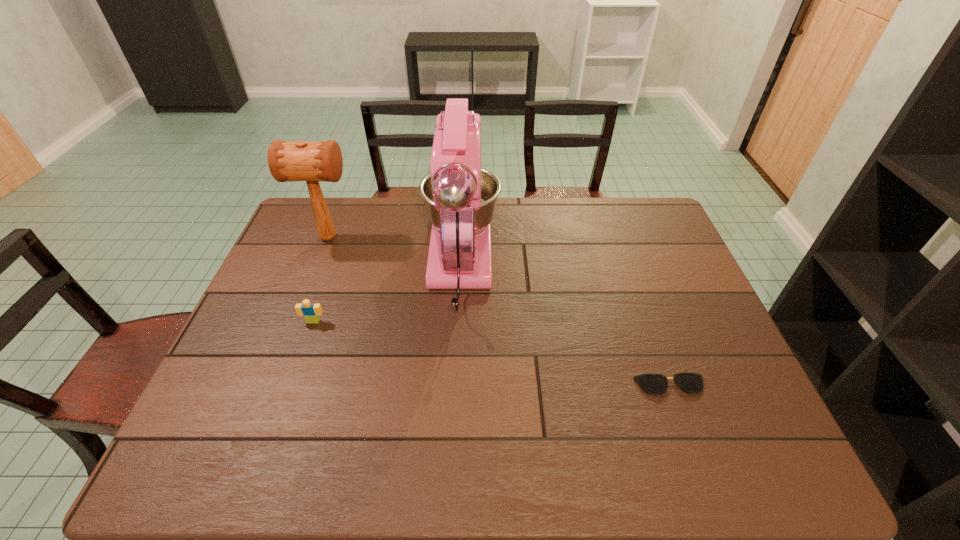
Identify the location of free location that satisfies the following two spatial constraints: 1. on the strike surface of the mallet; 2. on the face of the second object from right to left. This screenshot has width=960, height=540. (319, 266).

The image size is (960, 540). What are the coordinates of `free location that satisfies the following two spatial constraints: 1. on the face of the shortest object; 2. on the left side of the Lego` in the screenshot? It's located at (291, 386).

The image size is (960, 540). Identify the location of blank area in the image that satisfies the following two spatial constraints: 1. on the face of the third tallest object; 2. on the right side of the nearest object. (291, 386).

Locate an element on the screen. blank space that satisfies the following two spatial constraints: 1. on the face of the spectacles; 2. on the right side of the third tallest object is located at coordinates (291, 386).